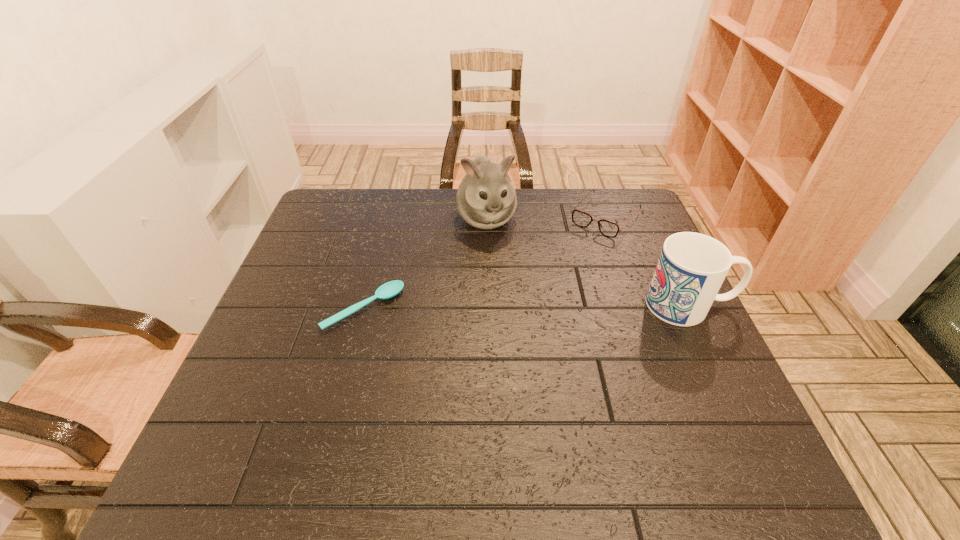
I want to click on free space between the spoon and the tallest object, so click(425, 264).

The image size is (960, 540). Find the location of `free spot between the sunglasses and the spoon`. free spot between the sunglasses and the spoon is located at coordinates (485, 263).

In order to click on blank region between the third object from right to left and the spoon in this screenshot , I will do `click(425, 264)`.

Locate an element on the screen. Image resolution: width=960 pixels, height=540 pixels. empty space between the hamster and the leftmost object is located at coordinates (425, 264).

Locate an element on the screen. This screenshot has width=960, height=540. empty space between the tallest object and the third shortest object is located at coordinates (588, 261).

In order to click on free space between the leftmost object and the sunglasses in this screenshot , I will do `click(485, 263)`.

Find the location of a particular element. The height and width of the screenshot is (540, 960). the third closest object to the third tallest object is located at coordinates (390, 289).

Identify which object is the third closest to the hamster. Please provide its 2D coordinates. Your answer should be formatted as a tuple, i.e. [(x, y)], where the tuple contains the x and y coordinates of a point satisfying the conditions above.

[(691, 268)]

At what (x,y) coordinates should I click in order to perform the action: click on vacant space that satisfies the following two spatial constraints: 1. on the back side of the sunglasses; 2. on the left side of the tallest object. Please return your answer as a coordinate pair (x, y). Looking at the image, I should click on (486, 217).

The image size is (960, 540). What are the coordinates of `vacant space that satisfies the following two spatial constraints: 1. on the back side of the second object from left to right; 2. on the left side of the sunglasses` in the screenshot? It's located at (486, 217).